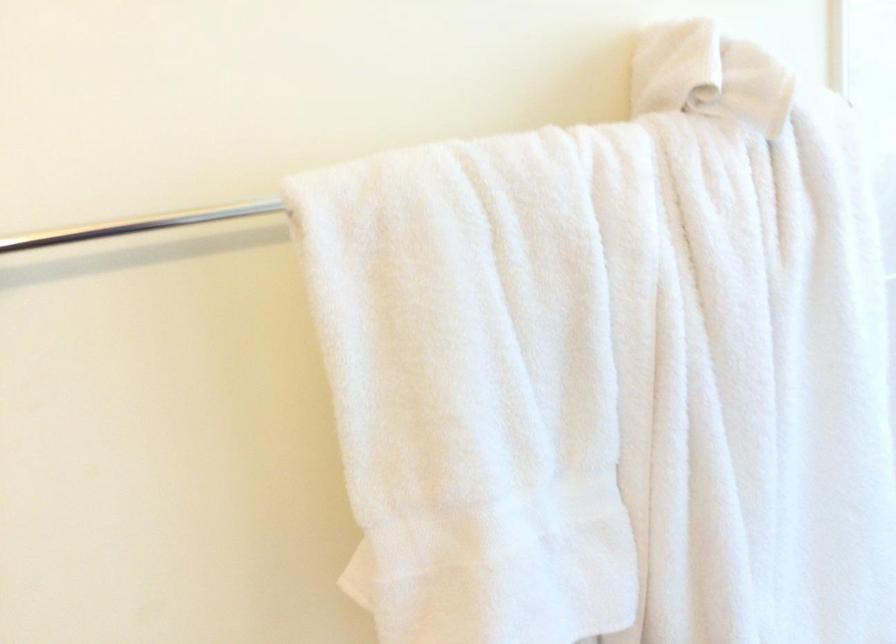
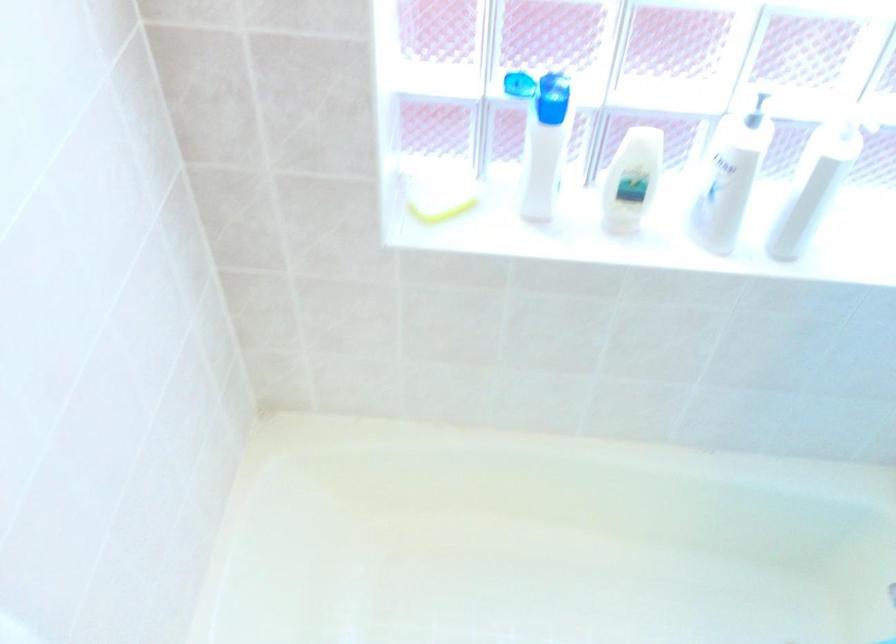
First-person continuous shooting, in which direction is the camera rotating?

The camera rotated toward right-down.